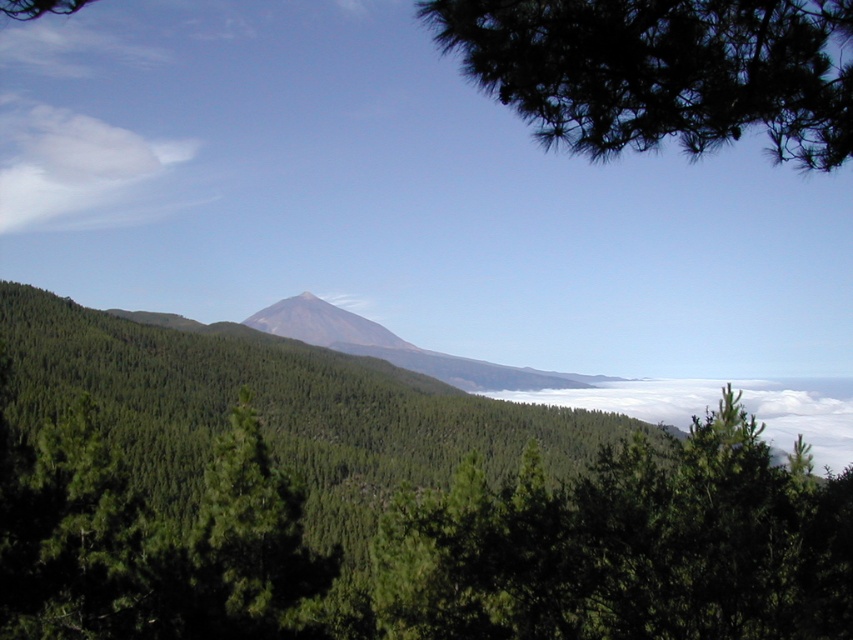
You are standing at the point closest to the foreground in the image. Which point, point (54, 209) or point (305, 339), is farther away from you?

Point (54, 209) is farther away because it is behind point (305, 339).

You are standing in the forest and see the green leafy tree at center and the dark green needles at upper right. Which one is positioned to the right side of the other?

The green leafy tree at center is positioned to the right of the dark green needles at upper right.